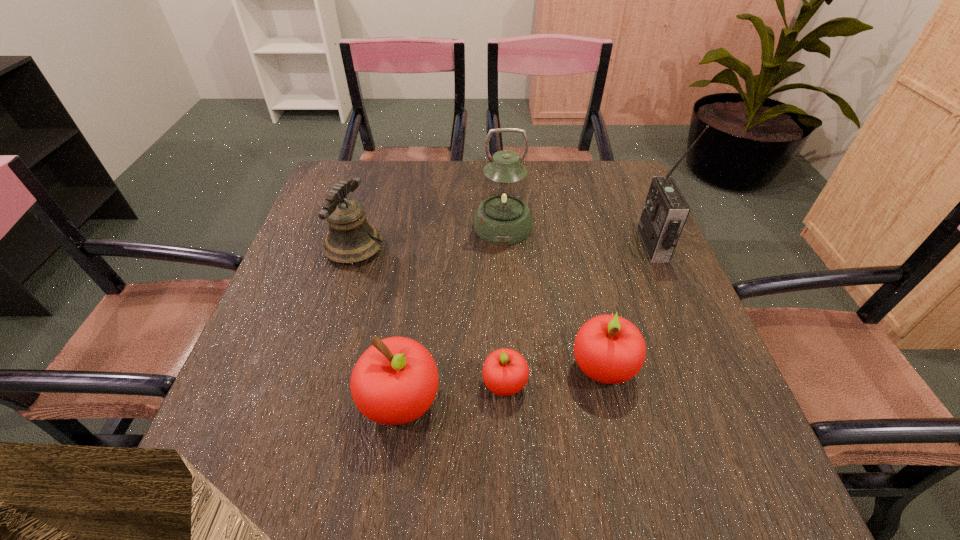
Find the location of `the leftmost apple`. the leftmost apple is located at coordinates coord(395,381).

What are the coordinates of `the shortest apple` in the screenshot? It's located at (505, 371).

I want to click on the shortest object, so click(x=505, y=371).

Locate an element on the screen. The width and height of the screenshot is (960, 540). the rightmost apple is located at coordinates (609, 349).

Where is `the fifth tallest object`? This screenshot has height=540, width=960. the fifth tallest object is located at coordinates (609, 349).

Where is `lantern`? This screenshot has height=540, width=960. lantern is located at coordinates (503, 217).

Where is `the rightmost object`? the rightmost object is located at coordinates (665, 211).

The width and height of the screenshot is (960, 540). I want to click on the leftmost object, so click(x=349, y=240).

You are a GUI agent. You are given a task and a screenshot of the screen. Output one action in this format:
    pyautogui.click(x=<x>, y=<y>)
    Task: Click on the vacant area situated on the right of the leftmost apple
    The width and height of the screenshot is (960, 540).
    Given the screenshot: What is the action you would take?
    pyautogui.click(x=643, y=402)

The width and height of the screenshot is (960, 540). I want to click on free location located 0.120m on the back of the shortest apple, so click(502, 318).